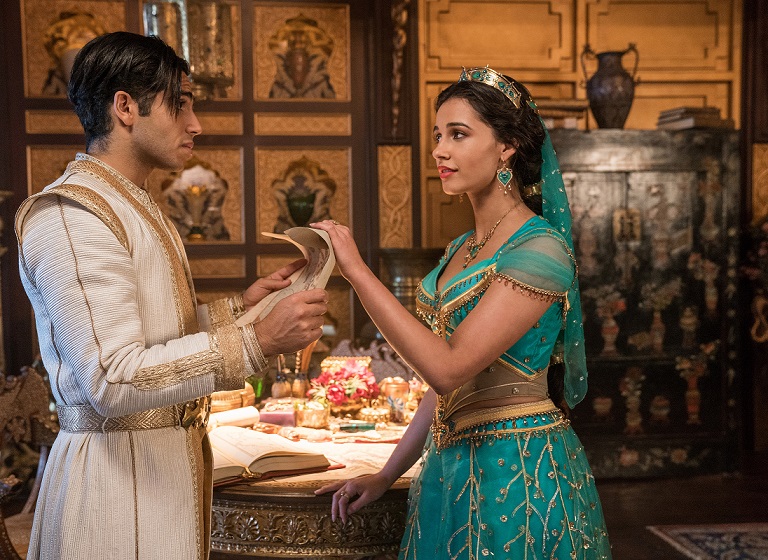
Where is `book`? book is located at coordinates (240, 447).